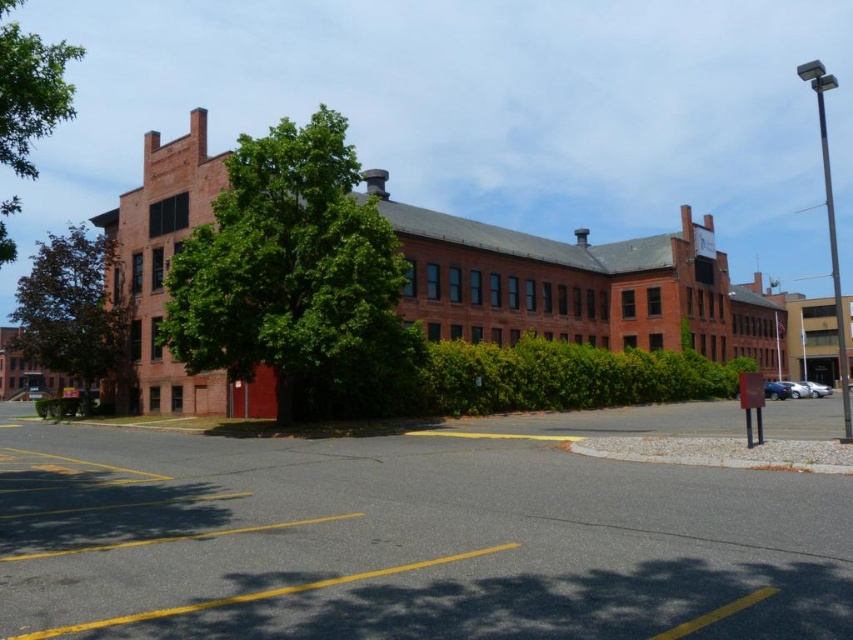
Does black asphalt parking lot at center have a greater height compared to green leafy tree at upper left?

No.

Is point (405, 449) farther from camera compared to point (0, 99)?

That is True.

Which is in front, point (140, 506) or point (51, 56)?

Positioned in front is point (140, 506).

Where is `black asphalt parking lot at center`? This screenshot has height=640, width=853. black asphalt parking lot at center is located at coordinates (413, 536).

Who is more distant from viewer, [86,394] or [50,44]?

Positioned behind is point [50,44].

Is green leafy tree at left to the left of green leafy tree at upper left from the viewer's perspective?

In fact, green leafy tree at left is to the right of green leafy tree at upper left.

Image resolution: width=853 pixels, height=640 pixels. In order to click on green leafy tree at left in this screenshot , I will do `click(73, 310)`.

The width and height of the screenshot is (853, 640). What are the coordinates of `green leafy tree at left` in the screenshot? It's located at (73, 310).

Is point (329, 205) positioned in front of point (39, 124)?

No, (329, 205) is behind (39, 124).

Who is higher up, green leafy tree at center or green leafy tree at upper left?

Positioned higher is green leafy tree at upper left.

Where is `green leafy tree at center`? The width and height of the screenshot is (853, 640). green leafy tree at center is located at coordinates (291, 275).